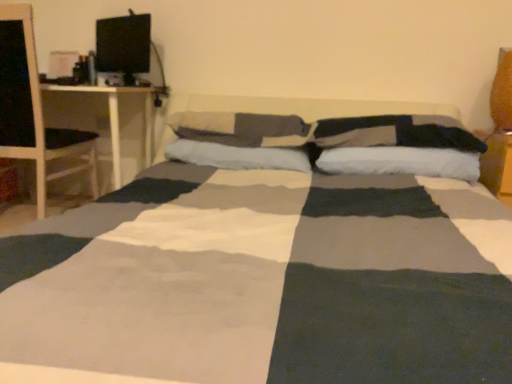
Question: Considering the relative positions of wooden table at right and soft cotton pillow at center, which is the fifth pillow in right-to-left order, in the image provided, is wooden table at right to the left or to the right of soft cotton pillow at center, which is the fifth pillow in right-to-left order,?

Choices:
 (A) left
 (B) right

Answer: (B)

Question: Relative to soft cotton pillow at center, the 1th pillow from the left, is wooden table at right in front or behind?

Choices:
 (A) behind
 (B) front

Answer: (B)

Question: Estimate the real-world distances between objects in this image. Which object is farther from the wooden table at right?

Choices:
 (A) black glossy computer monitor at upper left
 (B) white soft pillow at center, the fourth pillow positioned from the left
 (C) velvet orange pillow at upper right, the 1th pillow from the right
 (D) soft cotton pillow at center, which is the fifth pillow in right-to-left order
 (E) white wood desk at left

Answer: (A)

Question: Estimate the real-world distances between objects in this image. Which object is farther from the wooden table at right?

Choices:
 (A) white soft pillow at center, the fourth pillow when ordered from right to left
 (B) black glossy computer monitor at upper left
 (C) soft cotton pillow at center, the 1th pillow from the left
 (D) velvet orange pillow at upper right, the fifth pillow when ordered from left to right
 (E) dark gray fabric pillow at center, the third pillow in the left-to-right sequence

Answer: (B)